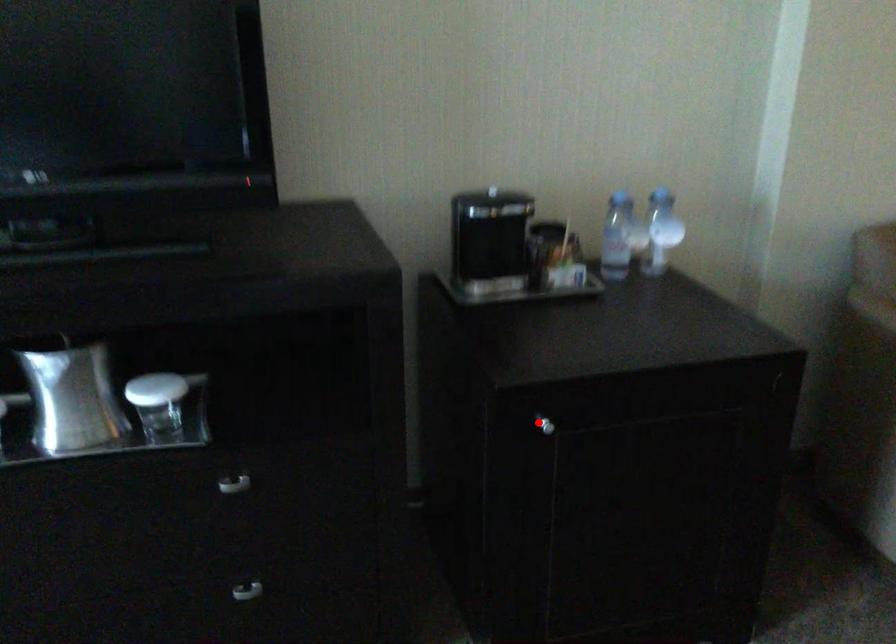
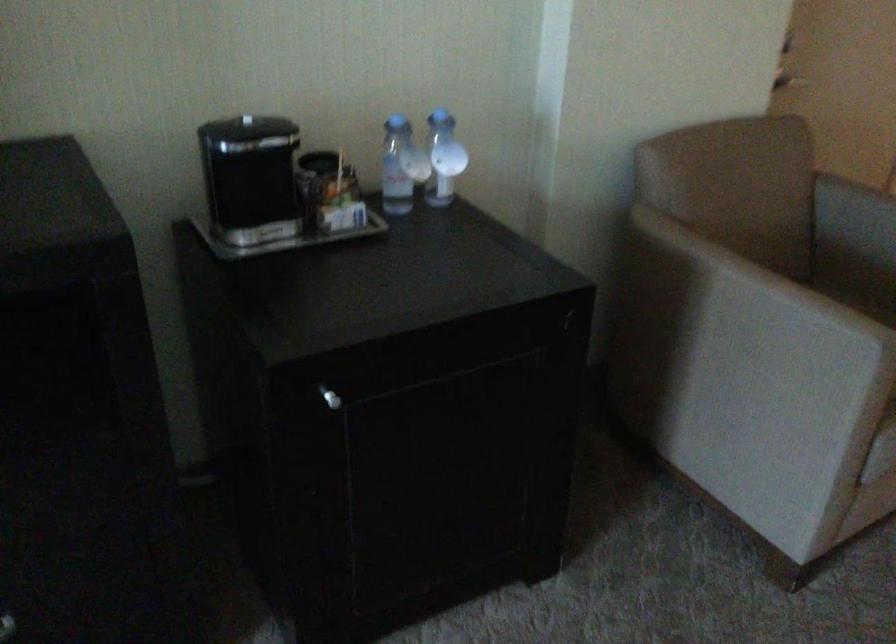
Locate, in the second image, the point that corresponds to the highlighted location in the first image.

(330, 398)